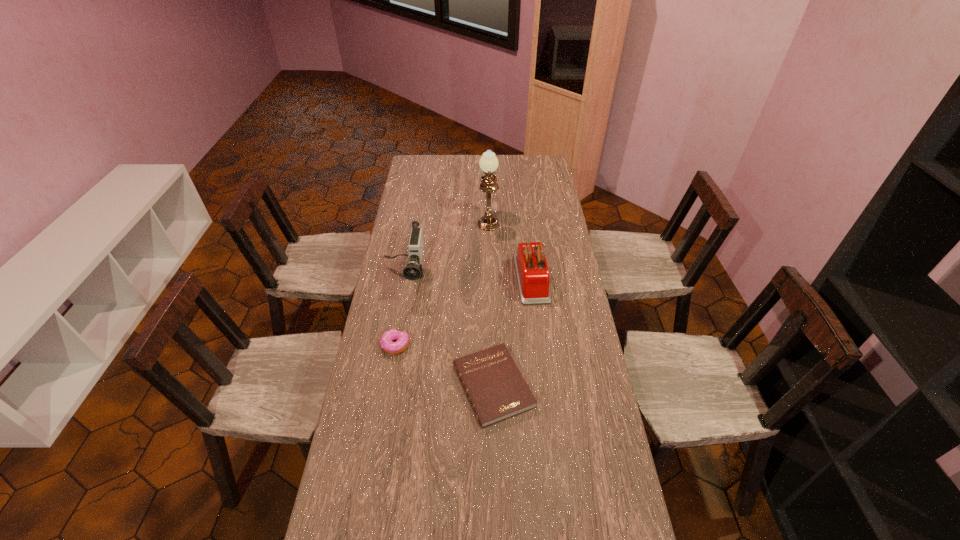
Locate an element on the screen. This screenshot has width=960, height=540. the farthest object is located at coordinates (488, 163).

You are a GUI agent. You are given a task and a screenshot of the screen. Output one action in this format:
    pyautogui.click(x=<x>, y=<y>)
    Task: Click on the oil lamp
    
    Given the screenshot: What is the action you would take?
    pyautogui.click(x=488, y=163)

Find the location of a particular element. camcorder is located at coordinates (413, 271).

What are the coordinates of `toaster` in the screenshot? It's located at (533, 277).

Where is `doughnut`? The width and height of the screenshot is (960, 540). doughnut is located at coordinates (386, 342).

Where is `hardback book`? The width and height of the screenshot is (960, 540). hardback book is located at coordinates (496, 389).

The image size is (960, 540). I want to click on vacant space situated 0.180m on the back of the oil lamp, so click(x=488, y=185).

The width and height of the screenshot is (960, 540). What are the coordinates of `vacant point located on the recording direction of the camcorder` in the screenshot? It's located at (396, 328).

The image size is (960, 540). Find the location of `vacant space located on the left of the toaster`. vacant space located on the left of the toaster is located at coordinates (444, 278).

Where is `vacant space situated 0.210m on the right of the doughnut`? vacant space situated 0.210m on the right of the doughnut is located at coordinates (470, 345).